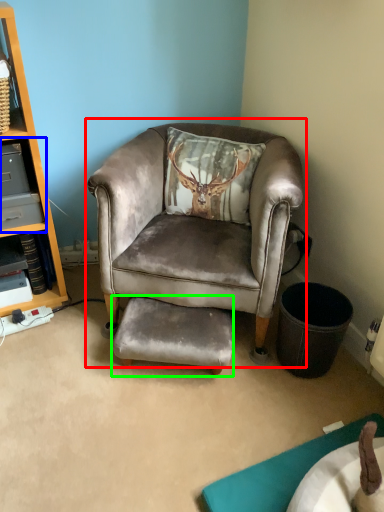
Question: Considering the real-world distances, which object is closest to chair (highlighted by a red box)? shelf (highlighted by a blue box) or footrest (highlighted by a green box).

Choices:
 (A) shelf
 (B) footrest

Answer: (B)